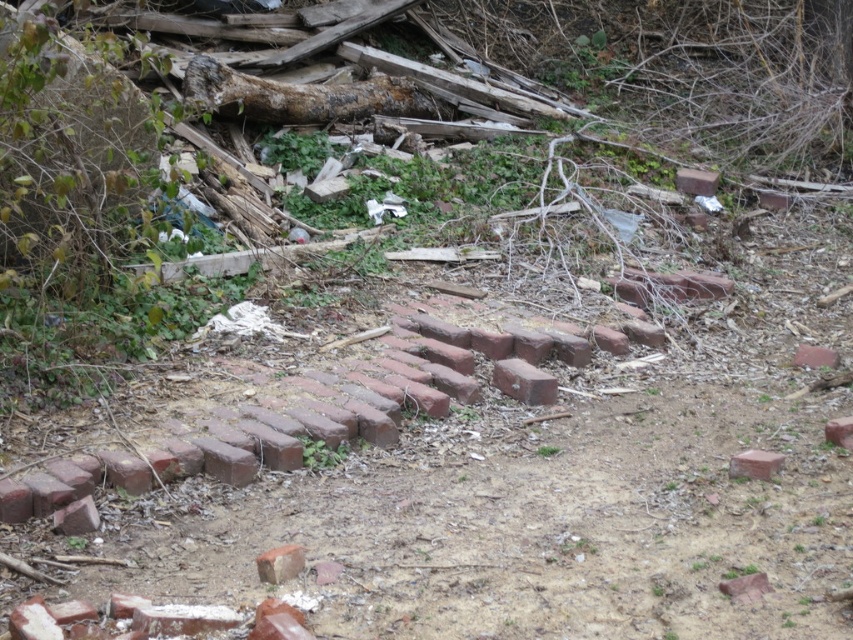
From the picture: Does smooth red brick at center have a lesser width compared to red clay brick at center?

In fact, smooth red brick at center might be wider than red clay brick at center.

Is smooth red brick at center smaller than red clay brick at center?

No.

Describe the element at coordinates (695, 180) in the screenshot. The height and width of the screenshot is (640, 853). I see `smooth red brick at center` at that location.

Where is `smooth red brick at center`? smooth red brick at center is located at coordinates (695, 180).

Is red brick at center smaller than red clay brick at lower right?

Yes, red brick at center is smaller than red clay brick at lower right.

Does red brick at center appear over red clay brick at lower right?

Actually, red brick at center is below red clay brick at lower right.

This screenshot has width=853, height=640. What do you see at coordinates (280, 563) in the screenshot?
I see `red brick at center` at bounding box center [280, 563].

You are a GUI agent. You are given a task and a screenshot of the screen. Output one action in this format:
    pyautogui.click(x=<x>, y=<y>)
    Task: Click on the red brick at center
    The image size is (853, 640).
    Given the screenshot: What is the action you would take?
    pyautogui.click(x=280, y=563)

Is red clay brick at lower right to the right of smooth red brick at center from the viewer's perspective?

→ No, red clay brick at lower right is not to the right of smooth red brick at center.

Is point (753, 456) more distant than point (691, 182)?

No, (753, 456) is in front of (691, 182).

The height and width of the screenshot is (640, 853). Identify the location of red clay brick at lower right. (755, 465).